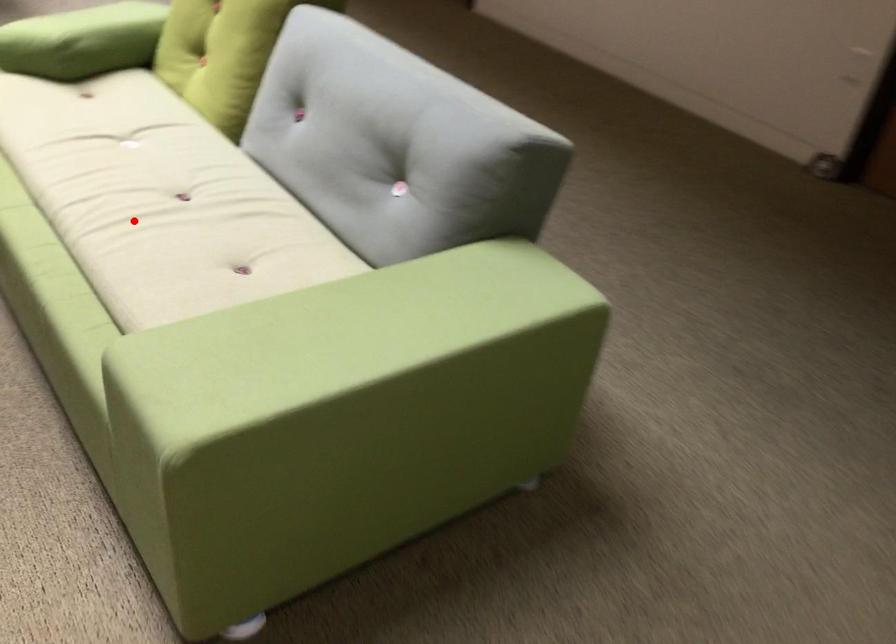
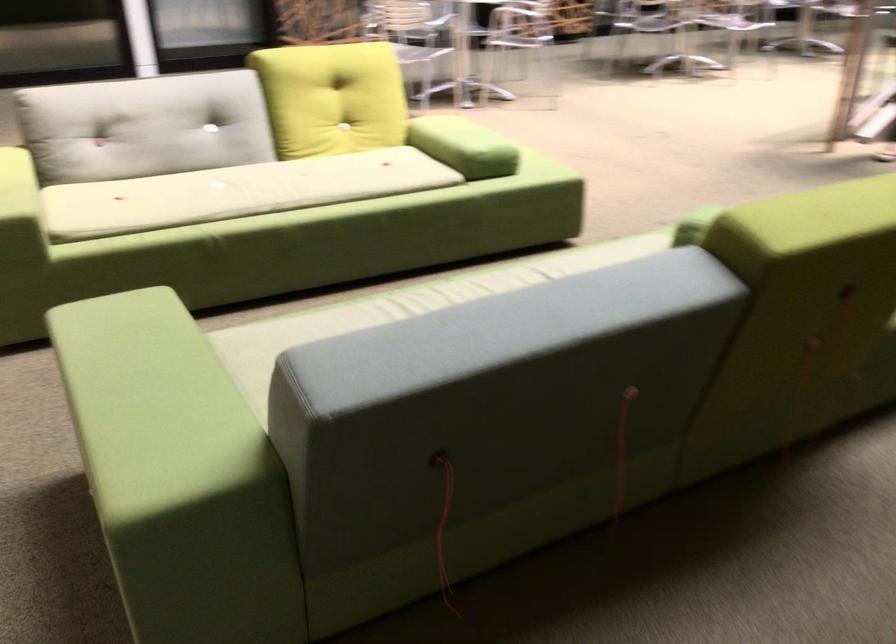
The point at the highlighted location is marked in the first image. Where is the corresponding point in the second image?

(401, 308)